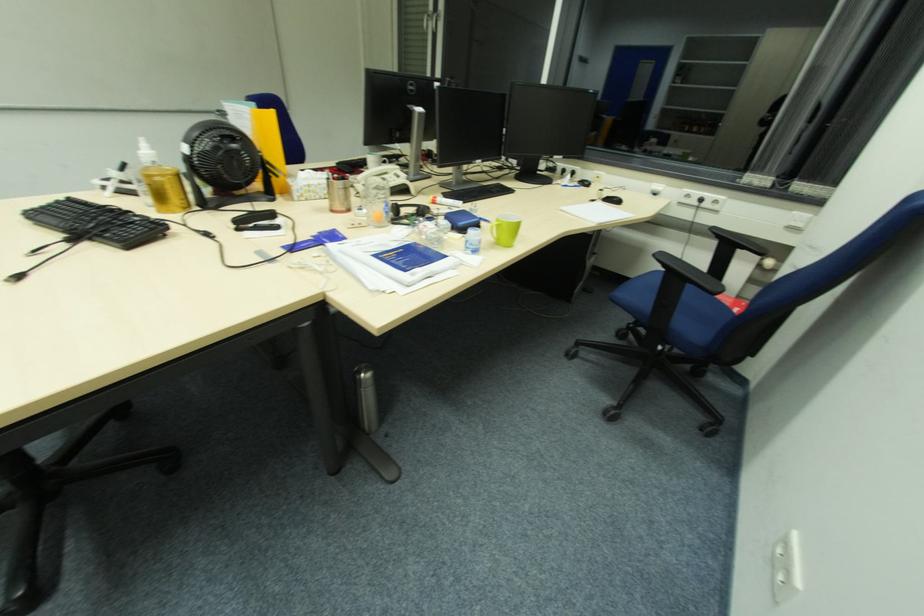
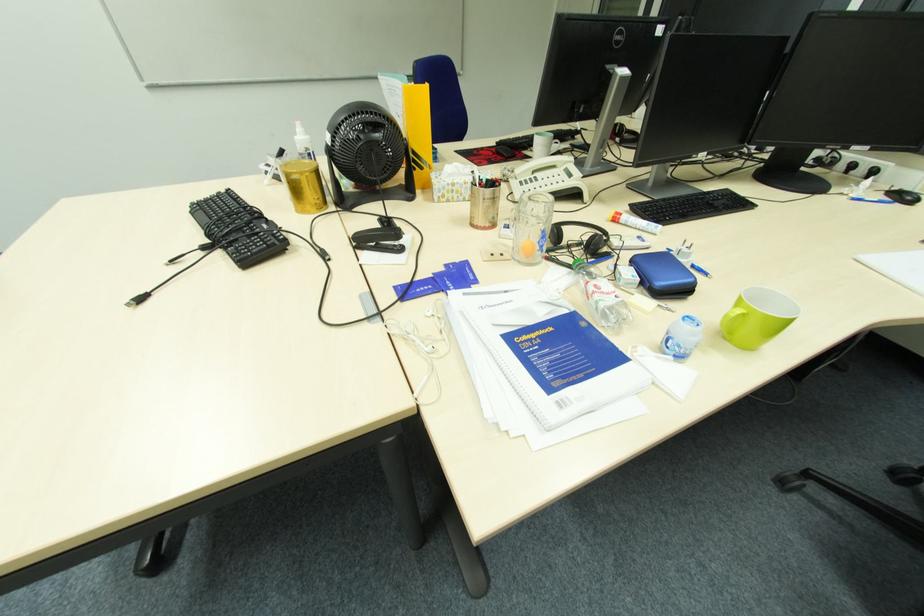
Question: The camera is either moving clockwise (left) or counter-clockwise (right) around the object. The first image is from the beginning of the video and the second image is from the end. Is the camera moving left or right when shooting the video?

Choices:
 (A) Left
 (B) Right

Answer: (B)